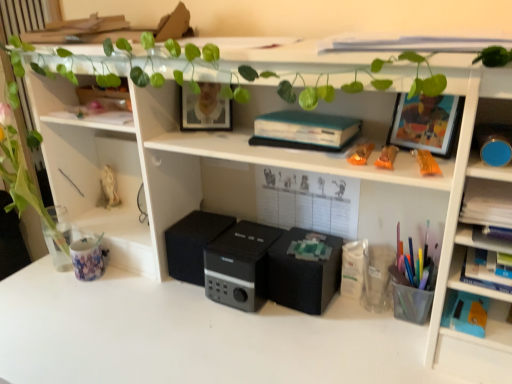
Question: Considering the relative sizes of black matte speaker at center, the 3th speaker in the left-to-right sequence, and translucent plastic cup at right, which is counted as the 1th stationery, starting from the bottom, in the image provided, is black matte speaker at center, the 3th speaker in the left-to-right sequence, bigger than translucent plastic cup at right, which is counted as the 1th stationery, starting from the bottom,?

Choices:
 (A) no
 (B) yes

Answer: (B)

Question: From the image's perspective, would you say black matte speaker at center, the 3th speaker in the left-to-right sequence, is shown under translucent plastic cup at right, which is counted as the 1th stationery, starting from the bottom?

Choices:
 (A) yes
 (B) no

Answer: (B)

Question: Can you confirm if black matte speaker at center, the 3th speaker in the left-to-right sequence, is positioned to the left of translucent plastic cup at right, marked as the third stationery in a left-to-right arrangement?

Choices:
 (A) yes
 (B) no

Answer: (A)

Question: Is black matte speaker at center, the 3th speaker in the left-to-right sequence, positioned with its back to translucent plastic cup at right, marked as the third stationery in a left-to-right arrangement?

Choices:
 (A) yes
 (B) no

Answer: (B)

Question: Is black matte speaker at center, the 3th speaker in the left-to-right sequence, completely or partially outside of translucent plastic cup at right, the second stationery viewed from the front?

Choices:
 (A) no
 (B) yes

Answer: (B)

Question: From a real-world perspective, is printed ceramic mug at left, acting as the 3th stationery starting from the front, above or below translucent plastic cup at right, marked as the third stationery in a left-to-right arrangement?

Choices:
 (A) above
 (B) below

Answer: (B)

Question: Is printed ceramic mug at left, the third stationery from the right, bigger or smaller than translucent plastic cup at right, positioned as the second stationery in back-to-front order?

Choices:
 (A) small
 (B) big

Answer: (A)

Question: In the image, is printed ceramic mug at left, arranged as the 2th stationery when ordered from the bottom, positioned in front of or behind translucent plastic cup at right, which is the first stationery in right-to-left order?

Choices:
 (A) behind
 (B) front

Answer: (A)

Question: In terms of height, does printed ceramic mug at left, which appears as the first stationery when viewed from the left, look taller or shorter compared to translucent plastic cup at right, marked as the third stationery in a left-to-right arrangement?

Choices:
 (A) short
 (B) tall

Answer: (A)

Question: From a real-world perspective, is green leafy plant at left above or below printed ceramic mug at left, acting as the 3th stationery starting from the front?

Choices:
 (A) below
 (B) above

Answer: (B)

Question: Is point (53, 238) closer or farther from the camera than point (94, 263)?

Choices:
 (A) farther
 (B) closer

Answer: (A)

Question: Based on their sizes in the image, would you say green leafy plant at left is bigger or smaller than printed ceramic mug at left, which is counted as the first stationery, starting from the back?

Choices:
 (A) big
 (B) small

Answer: (A)

Question: Which is correct: green leafy plant at left is inside printed ceramic mug at left, acting as the 3th stationery starting from the front, or outside of it?

Choices:
 (A) inside
 (B) outside

Answer: (B)

Question: Considering the positions of translucent plastic cup at right, which is counted as the 1th stationery, starting from the bottom, and translucent orange pen at upper right, which is the 1th stationery from top to bottom, in the image, is translucent plastic cup at right, which is counted as the 1th stationery, starting from the bottom, wider or thinner than translucent orange pen at upper right, which is the 1th stationery from top to bottom,?

Choices:
 (A) thin
 (B) wide

Answer: (A)

Question: Do you think translucent plastic cup at right, which is counted as the 1th stationery, starting from the bottom, is within translucent orange pen at upper right, the 2th stationery viewed from the left, or outside of it?

Choices:
 (A) outside
 (B) inside

Answer: (A)